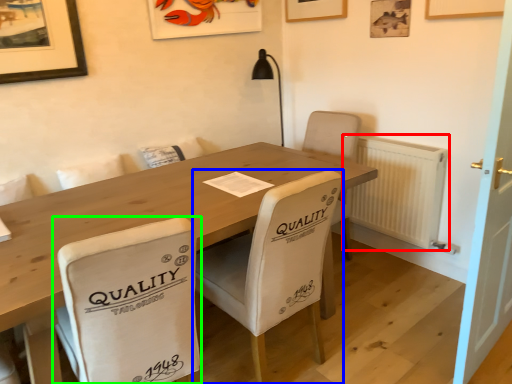
Question: Based on their relative distances, which object is farther from radiator (highlighted by a red box)? Choose from chair (highlighted by a blue box) and chair (highlighted by a green box).

Choices:
 (A) chair
 (B) chair

Answer: (B)